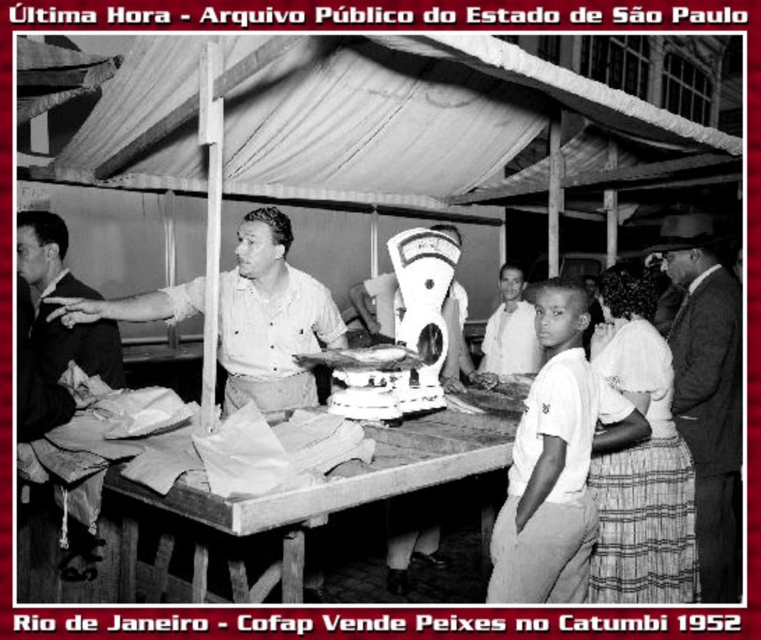
You are a customer at the market in the image. You want to buy fish from the vendor. Which object should you approach first, the wooden table at center or the smooth dark suit at right?

You should approach the wooden table at center first because it is in front of the smooth dark suit at right, making it closer to you as a customer.

In the 1952 Rio de Janeiro market scene, there is a wooden table at center and a smooth white shirt at center. Which object is positioned further to the left?

The wooden table at center is to the left of the smooth white shirt at center, so the wooden table at center is positioned further to the left.